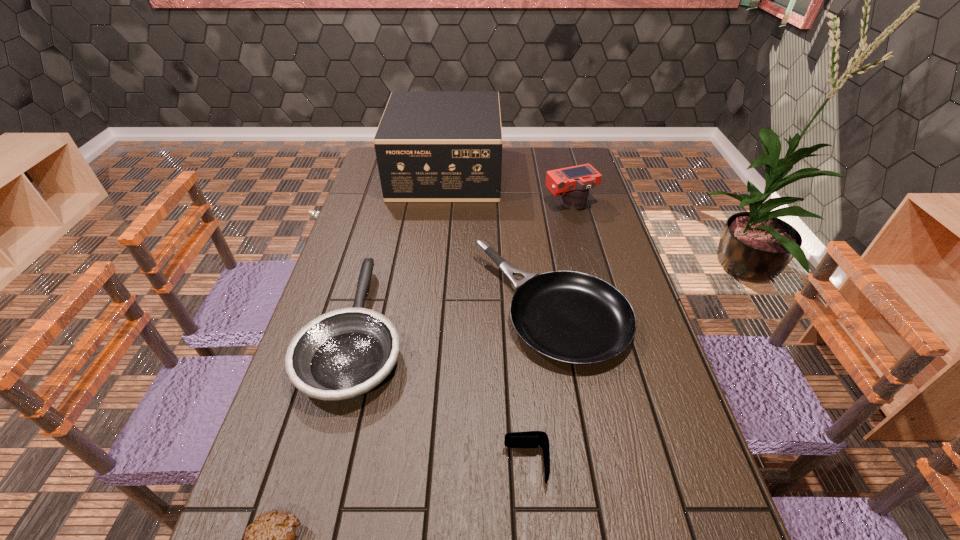
This screenshot has width=960, height=540. What are the coordinates of `box` in the screenshot? It's located at (431, 146).

This screenshot has height=540, width=960. I want to click on the second tallest object, so click(573, 183).

This screenshot has width=960, height=540. I want to click on pan, so click(571, 317).

The height and width of the screenshot is (540, 960). Identify the location of frying pan. (341, 355).

The image size is (960, 540). I want to click on wallet, so click(x=531, y=439).

The width and height of the screenshot is (960, 540). Find the location of `free region located 0.240m on the front-facing side of the box`. free region located 0.240m on the front-facing side of the box is located at coordinates (558, 173).

Locate an element on the screen. Image resolution: width=960 pixels, height=540 pixels. vacant space located 0.300m on the left of the camera is located at coordinates [462, 204].

The width and height of the screenshot is (960, 540). I want to click on vacant area situated 0.150m on the back of the pan, so click(x=538, y=228).

The width and height of the screenshot is (960, 540). I want to click on vacant space situated on the handle side of the frying pan, so click(x=386, y=220).

Locate an element on the screen. This screenshot has width=960, height=540. vacant position located 0.250m on the handle side of the frying pan is located at coordinates (385, 223).